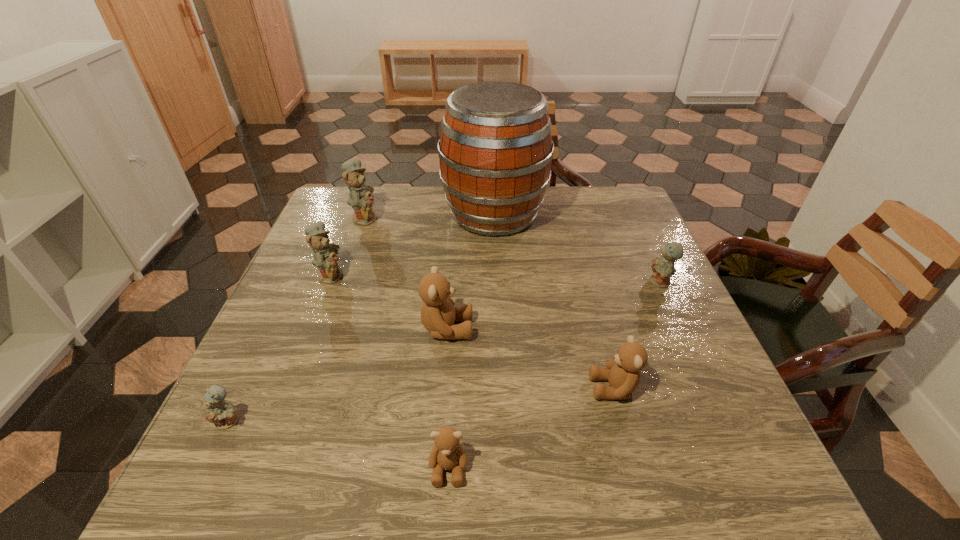
Find the location of a particular element. This screenshot has width=960, height=540. the second nearest object is located at coordinates (218, 411).

Where is `the leftmost blue teddy bear`? This screenshot has width=960, height=540. the leftmost blue teddy bear is located at coordinates (218, 411).

The image size is (960, 540). I want to click on the smallest brown teddy bear, so click(x=447, y=453).

Find the location of a particular element. The image size is (960, 540). the nearest object is located at coordinates point(447,453).

Identify the location of free spot located 0.060m on the right of the tallest object. (566, 214).

The height and width of the screenshot is (540, 960). Identify the location of free location located 0.130m on the front-facing side of the tallest teddy bear. (423, 217).

Image resolution: width=960 pixels, height=540 pixels. I want to click on vacant space located on the front-facing side of the third smallest blue teddy bear, so click(396, 274).

Identify the location of free space located 0.280m on the front-facing side of the biggest brown teddy bear. The width and height of the screenshot is (960, 540). (600, 328).

Where is `vacant space located on the front-facing side of the rightmost object`? The height and width of the screenshot is (540, 960). vacant space located on the front-facing side of the rightmost object is located at coordinates click(x=580, y=282).

Identify the location of blank space located 0.170m on the front-facing side of the rightmost object. This screenshot has width=960, height=540. (580, 282).